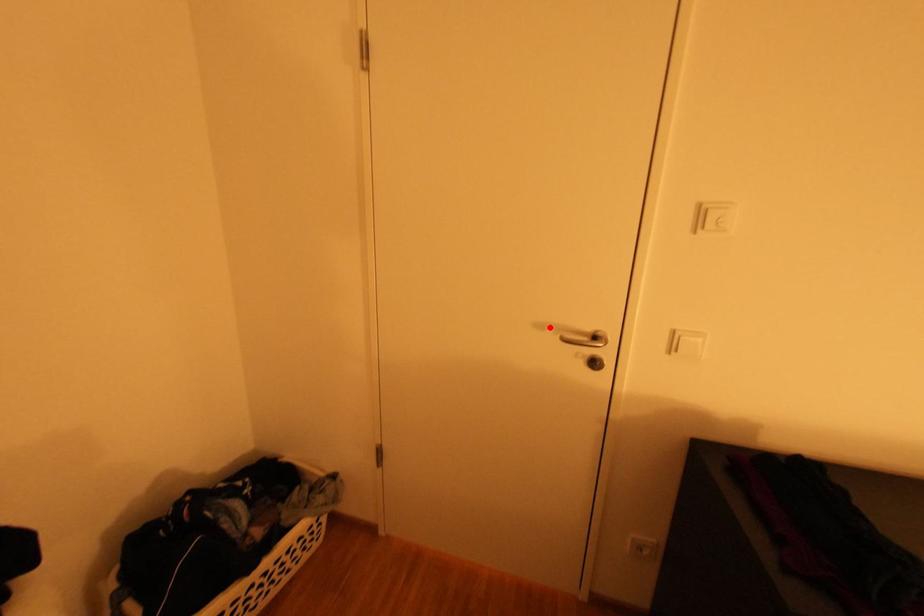
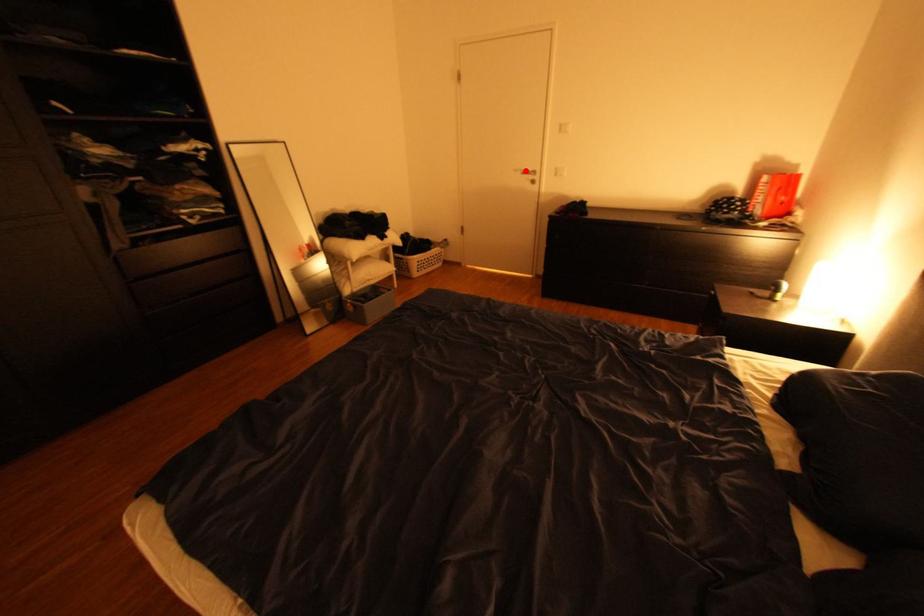
I am providing you with two images of the same scene from different viewpoints. A red point is marked on the first image and another point is marked on the second image. Is the red point in image1 aligned with the point shown in image2?

Yes